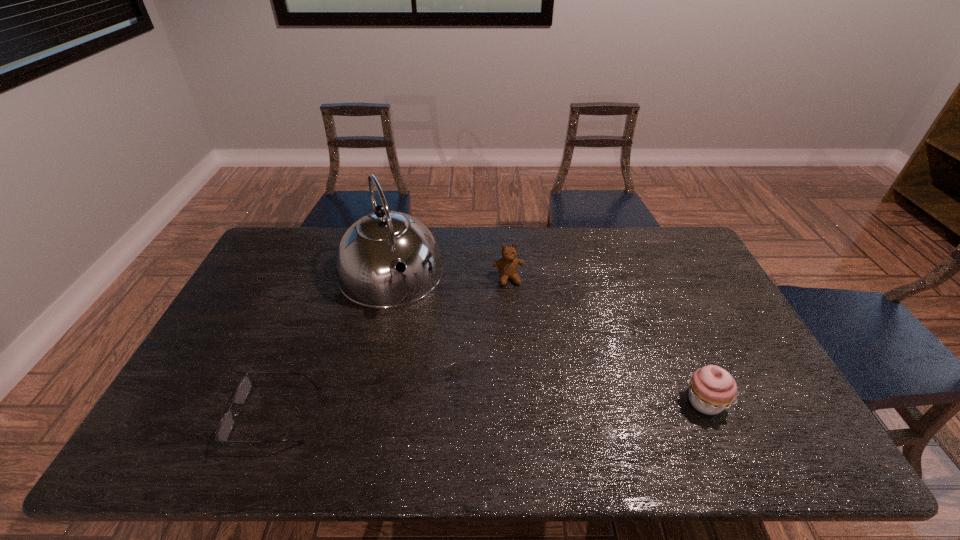
This screenshot has height=540, width=960. I want to click on vacant space on the desktop that is between the spectacles and the cupcake and is positioned from the spout of the kettle, so point(447,410).

Where is `free space on the desktop that is between the spectacles and the cupcake and is positioned on the front-facing side of the second object from right to left`? This screenshot has height=540, width=960. free space on the desktop that is between the spectacles and the cupcake and is positioned on the front-facing side of the second object from right to left is located at coordinates (542, 407).